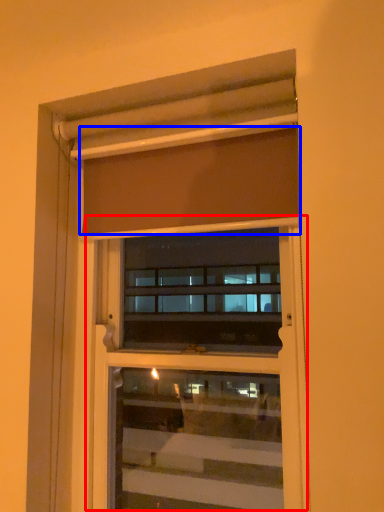
Question: Which object appears closest to the camera in this image, screen door (highlighted by a red box) or curtain (highlighted by a blue box)?

Choices:
 (A) screen door
 (B) curtain

Answer: (B)